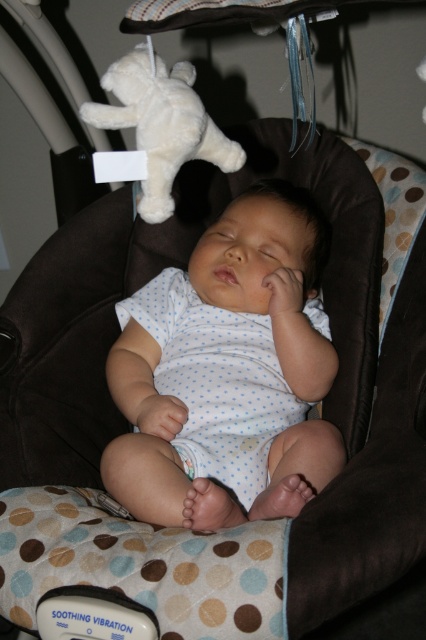
Is point (204, 260) more distant than point (101, 81)?

Yes, point (204, 260) is behind point (101, 81).

Is point (183, 497) closer to camera compared to point (160, 195)?

No, (183, 497) is behind (160, 195).

Locate an element on the screen. white dotted onesie at center is located at coordinates (x=227, y=372).